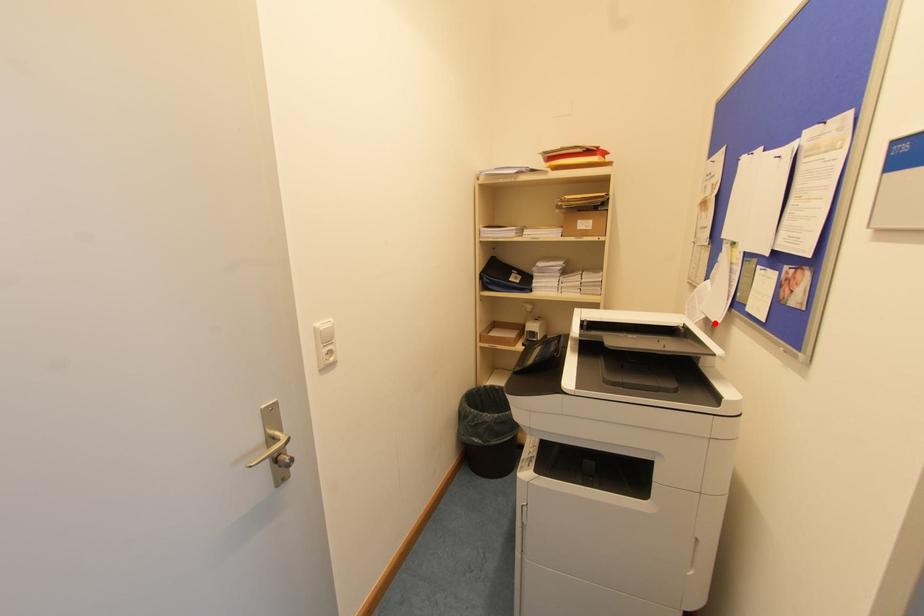
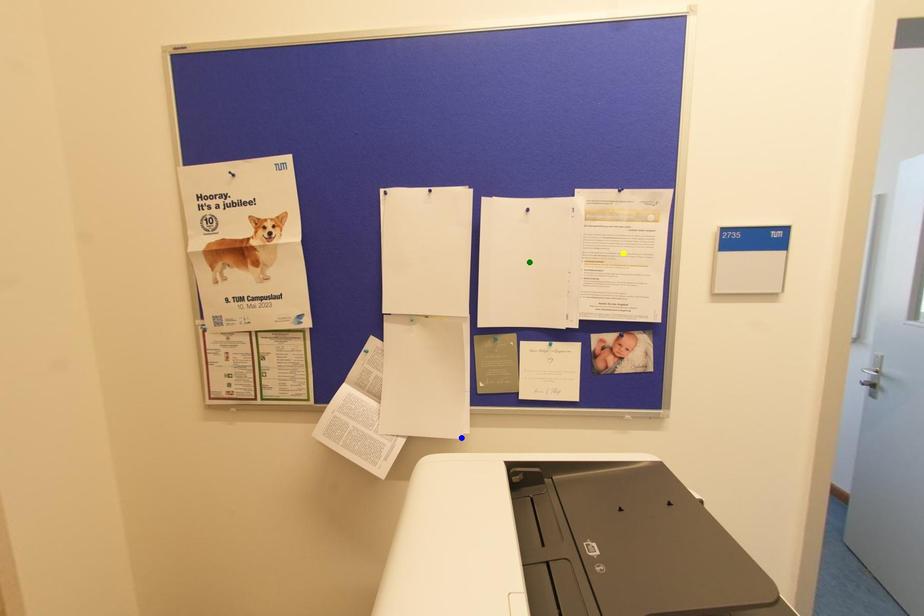
Question: I am providing you with two images of the same scene from different viewpoints. A red point is marked on the first image. You are given multiple points on the second image. Can you choose the point in image 2 that corresponds to the point in image 1?

Choices:
 (A) green point
 (B) yellow point
 (C) blue point

Answer: (C)